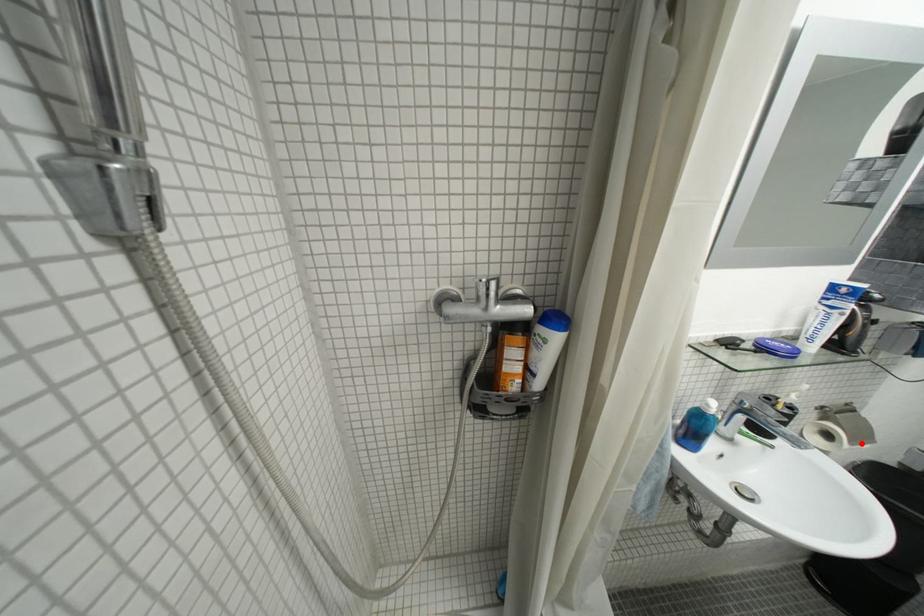
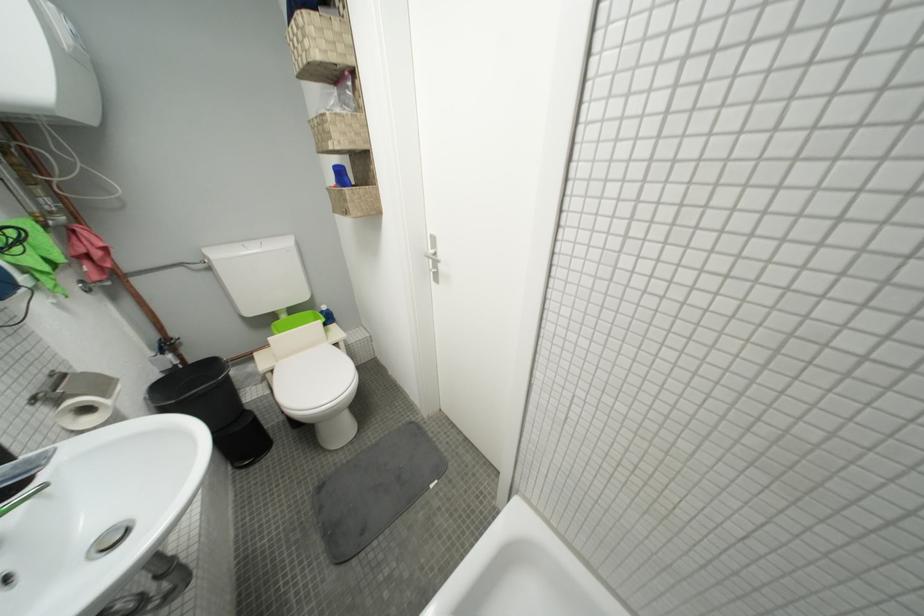
Question: I am providing you with two images of the same scene from different viewpoints. Given a red point in image1, look at the same physical point in image2. Is it:

Choices:
 (A) Closer to the viewpoint
 (B) Farther from the viewpoint

Answer: (B)